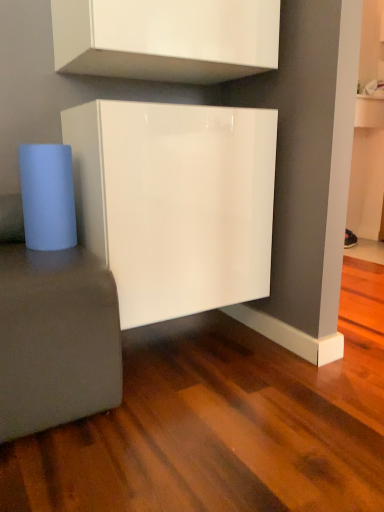
The image size is (384, 512). Find the location of `free spot to the right of matte gray side table at lower left`. free spot to the right of matte gray side table at lower left is located at coordinates (184, 416).